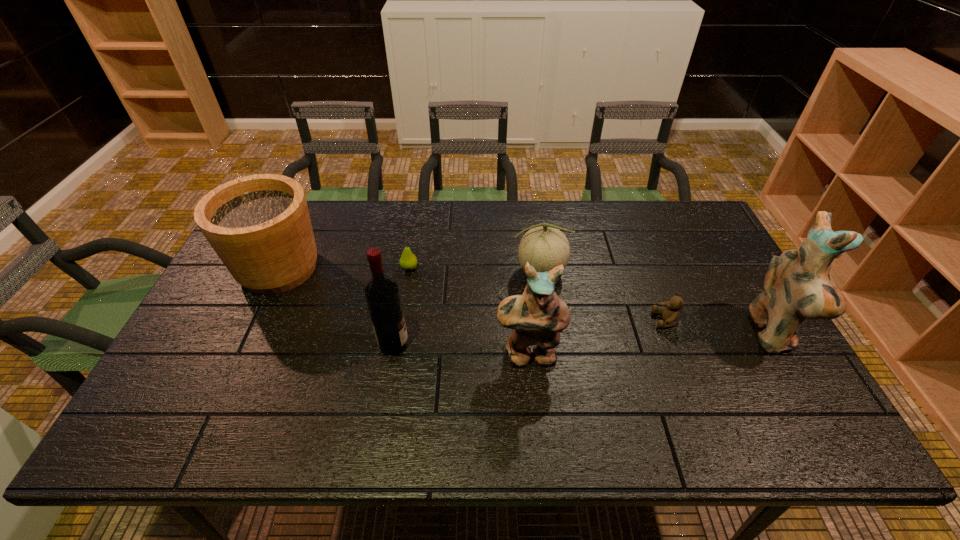
Please point a vacant point for placing a figurine on the left. Please provide its 2D coordinates. Your answer should be formatted as a tuple, i.e. [(x, y)], where the tuple contains the x and y coordinates of a point satisfying the conditions above.

[(265, 378)]